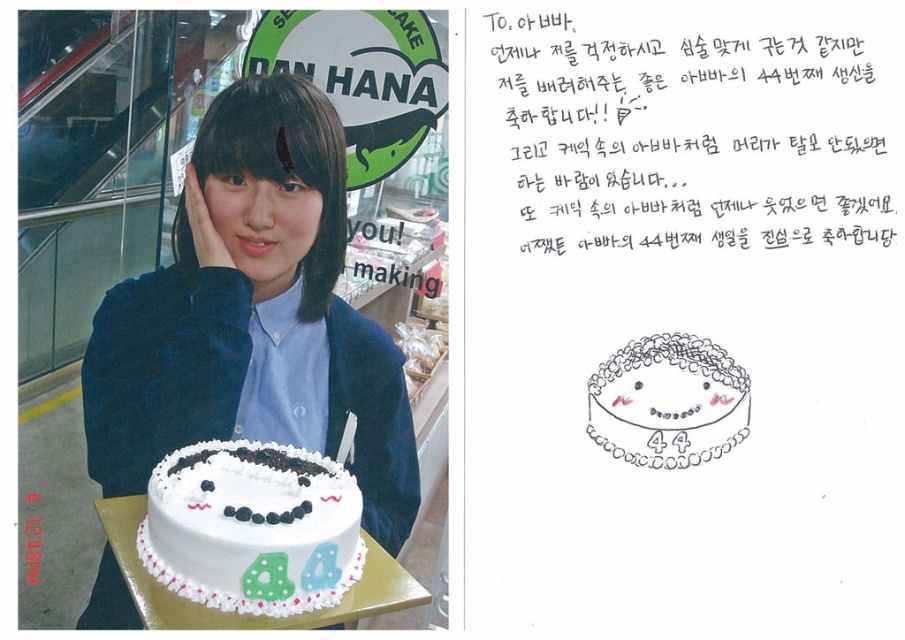
Between matte blue shirt at center and white frosted cake at center, which one has more height?

matte blue shirt at center

Identify the location of matte blue shirt at center. (253, 316).

Is matte blue shirt at center to the right of white frosted cake with chocolate decorations at lower center from the viewer's perspective?

In fact, matte blue shirt at center is to the left of white frosted cake with chocolate decorations at lower center.

Does matte blue shirt at center have a greater width compared to white frosted cake with chocolate decorations at lower center?

Indeed, matte blue shirt at center has a greater width compared to white frosted cake with chocolate decorations at lower center.

Which is in front, point (206, 360) or point (253, 580)?

Point (253, 580)

This screenshot has height=640, width=905. In order to click on matte blue shirt at center in this screenshot , I will do `click(253, 316)`.

The height and width of the screenshot is (640, 905). I want to click on white frosted cake with chocolate decorations at lower center, so click(x=252, y=528).

Is white frosted cake with chocolate decorations at lower center positioned before white frosted cake at center?

No, white frosted cake with chocolate decorations at lower center is further to the viewer.

Measure the distance between white frosted cake with chocolate decorations at lower center and camera.

white frosted cake with chocolate decorations at lower center is 1.04 meters from camera.

Image resolution: width=905 pixels, height=640 pixels. Find the location of `white frosted cake with chocolate decorations at lower center`. white frosted cake with chocolate decorations at lower center is located at coordinates [x=252, y=528].